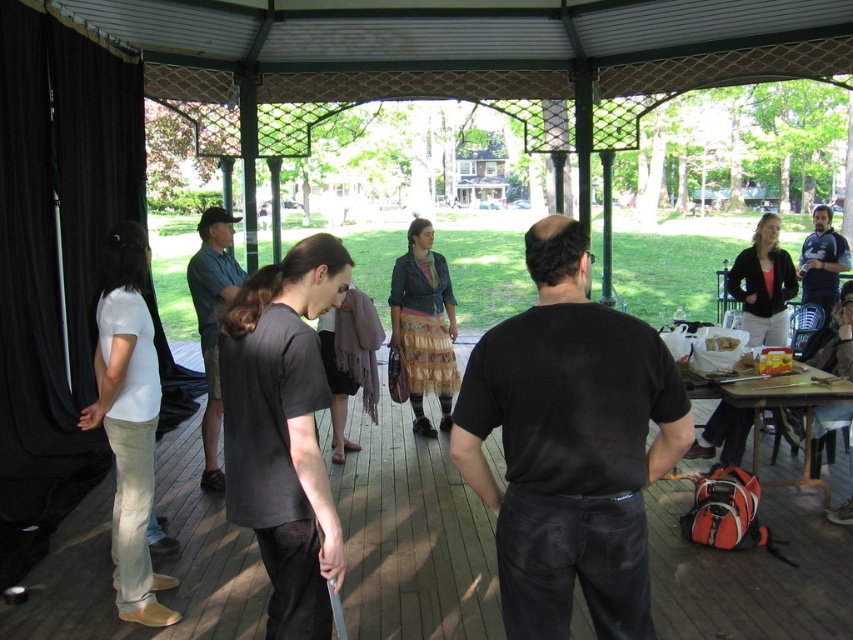
Question: Which point is farther from the camera taking this photo?

Choices:
 (A) (827, 316)
 (B) (231, 216)
 (C) (787, 388)

Answer: (A)

Question: Which point is farther to the camera?

Choices:
 (A) blue denim shirt at right
 (B) wooden picnic table at lower right
 (C) blue denim shorts at center
 (D) black matte shirt at center

Answer: (A)

Question: Is black matte shirt at center further to the viewer compared to blue denim shorts at center?

Choices:
 (A) yes
 (B) no

Answer: (B)

Question: Estimate the real-world distances between objects in this image. Which object is farther from the black matte shirt at center?

Choices:
 (A) blue denim shirt at right
 (B) wooden picnic table at lower right
 (C) blue denim shorts at center

Answer: (A)

Question: Can you confirm if blue denim shorts at center is wider than wooden picnic table at lower right?

Choices:
 (A) no
 (B) yes

Answer: (A)

Question: Can you confirm if wooden picnic table at lower right is bigger than blue denim shirt at right?

Choices:
 (A) no
 (B) yes

Answer: (A)